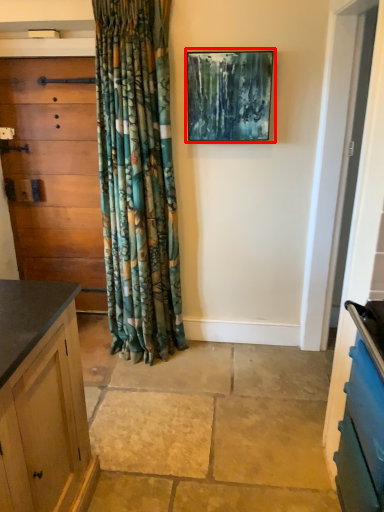
Question: From the image's perspective, what is the correct spatial positioning of picture frame (annotated by the red box) in reference to chest of drawers?

Choices:
 (A) below
 (B) above

Answer: (B)